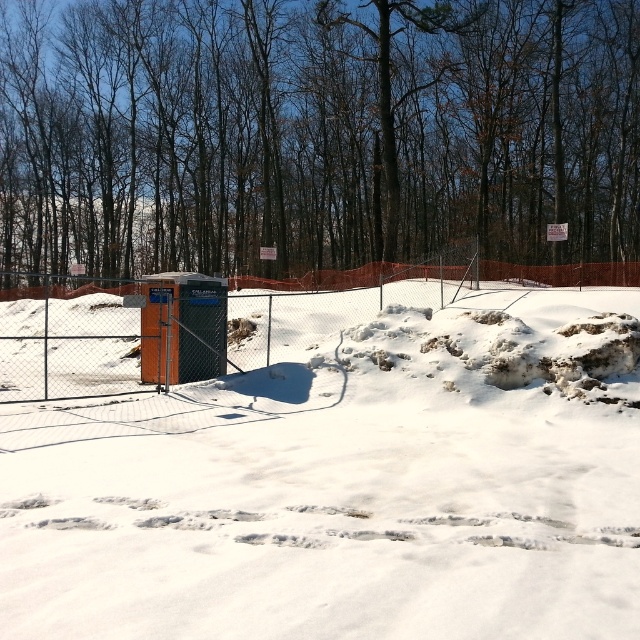
Question: Which point is farther to the camera?

Choices:
 (A) tap(356, 36)
 (B) tap(556, 330)

Answer: (A)

Question: Among these points, which one is farthest from the camera?

Choices:
 (A) (300, 413)
 (B) (172, 172)

Answer: (B)

Question: Does white powdery snow at center appear on the left side of metal chain-link fence at center?

Choices:
 (A) yes
 (B) no

Answer: (B)

Question: Does white powdery snow at center appear under metal chain-link fence at center?

Choices:
 (A) yes
 (B) no

Answer: (A)

Question: Considering the relative positions of white powdery snow at center and metal chain-link fence at center in the image provided, where is white powdery snow at center located with respect to metal chain-link fence at center?

Choices:
 (A) below
 (B) above

Answer: (A)

Question: Which of the following is the closest to the observer?

Choices:
 (A) white powdery snow at center
 (B) metal chain-link fence at center
 (C) brown bark tree at center

Answer: (A)